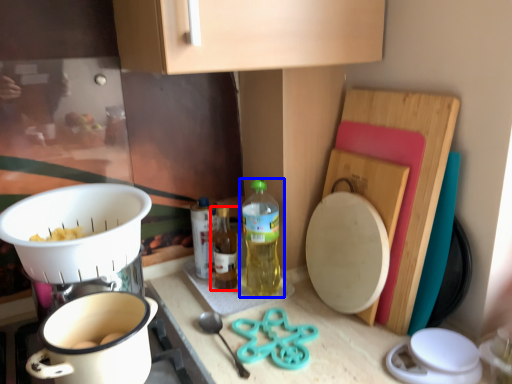
Question: Among these objects, which one is farthest to the camera, bottle (highlighted by a red box) or bottle (highlighted by a blue box)?

Choices:
 (A) bottle
 (B) bottle

Answer: (A)